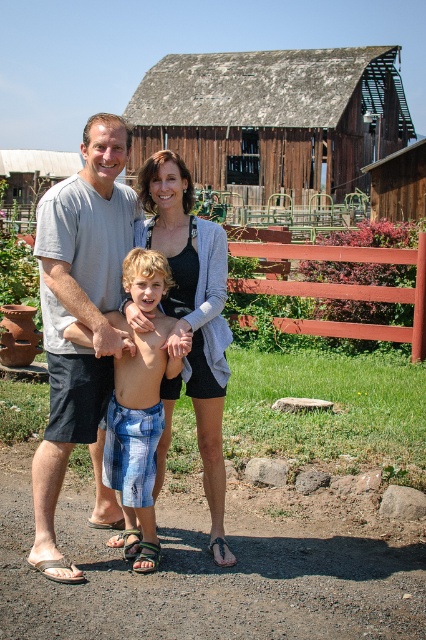
Question: Which point is farther from the camera taking this photo?

Choices:
 (A) (28, 563)
 (B) (184, 209)

Answer: (B)

Question: Does gray cotton shirt at center have a greater width compared to blue plaid shorts at center?

Choices:
 (A) no
 (B) yes

Answer: (B)

Question: Does gray cotton shirt at center appear over red wooden fence at center?

Choices:
 (A) yes
 (B) no

Answer: (A)

Question: Is red wooden fence at center to the left of brushed metal hut at upper center from the viewer's perspective?

Choices:
 (A) no
 (B) yes

Answer: (A)

Question: Which of the following is the closest to the observer?

Choices:
 (A) blue plaid shorts at center
 (B) matte gray sweater at center
 (C) black leather sandal at lower center

Answer: (A)

Question: Which point appears farthest from the camera in this image?

Choices:
 (A) (158, 552)
 (B) (40, 465)
 (C) (115, 406)
 (D) (54, 560)

Answer: (A)